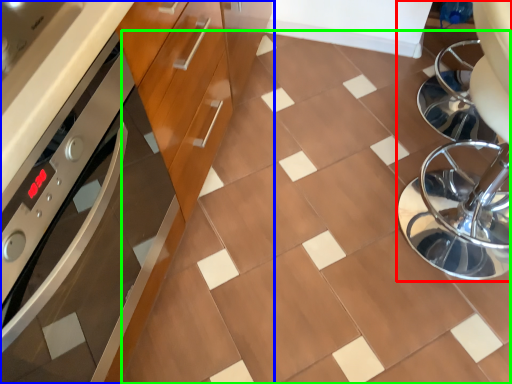
Question: Which object is the farthest from swivel chair (highlighted by a red box)? Choose among these: cabinetry (highlighted by a blue box) or ceramic tile (highlighted by a green box).

Choices:
 (A) cabinetry
 (B) ceramic tile

Answer: (A)